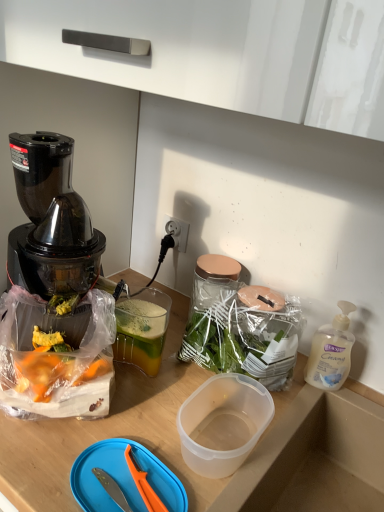
Question: From a real-world perspective, relative to translucent plastic soap dispenser at right, is blue plastic cutting board at lower center vertically above or below?

Choices:
 (A) below
 (B) above

Answer: (A)

Question: Considering the positions of blue plastic cutting board at lower center and translucent plastic soap dispenser at right in the image, is blue plastic cutting board at lower center taller or shorter than translucent plastic soap dispenser at right?

Choices:
 (A) tall
 (B) short

Answer: (B)

Question: Looking at the image, does blue plastic cutting board at lower center seem bigger or smaller compared to translucent plastic soap dispenser at right?

Choices:
 (A) small
 (B) big

Answer: (A)

Question: Considering the positions of translucent plastic soap dispenser at right and blue plastic cutting board at lower center in the image, is translucent plastic soap dispenser at right bigger or smaller than blue plastic cutting board at lower center?

Choices:
 (A) small
 (B) big

Answer: (B)

Question: Visually, is translucent plastic soap dispenser at right positioned to the left or to the right of blue plastic cutting board at lower center?

Choices:
 (A) left
 (B) right

Answer: (B)

Question: In terms of width, does translucent plastic soap dispenser at right look wider or thinner when compared to blue plastic cutting board at lower center?

Choices:
 (A) wide
 (B) thin

Answer: (B)

Question: In the image, is translucent plastic soap dispenser at right positioned in front of or behind blue plastic cutting board at lower center?

Choices:
 (A) behind
 (B) front

Answer: (A)